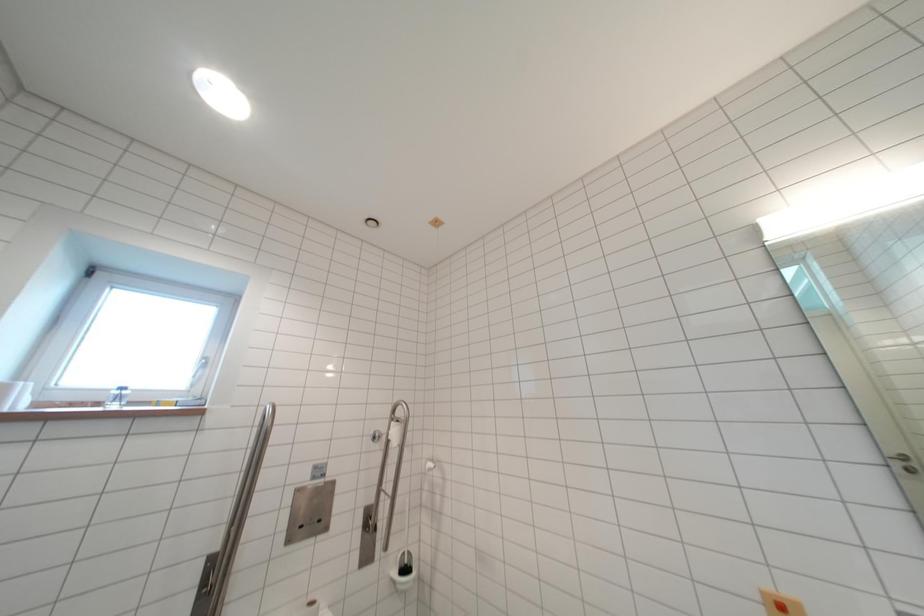
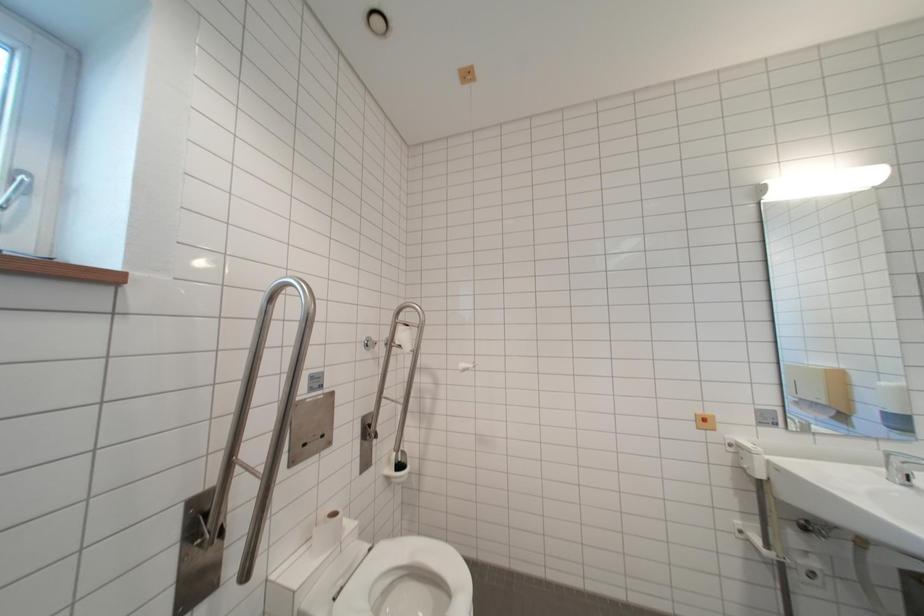
Question: The camera is either moving clockwise (left) or counter-clockwise (right) around the object. The first image is from the beginning of the video and the second image is from the end. Is the camera moving left or right when shooting the video?

Choices:
 (A) Left
 (B) Right

Answer: (A)